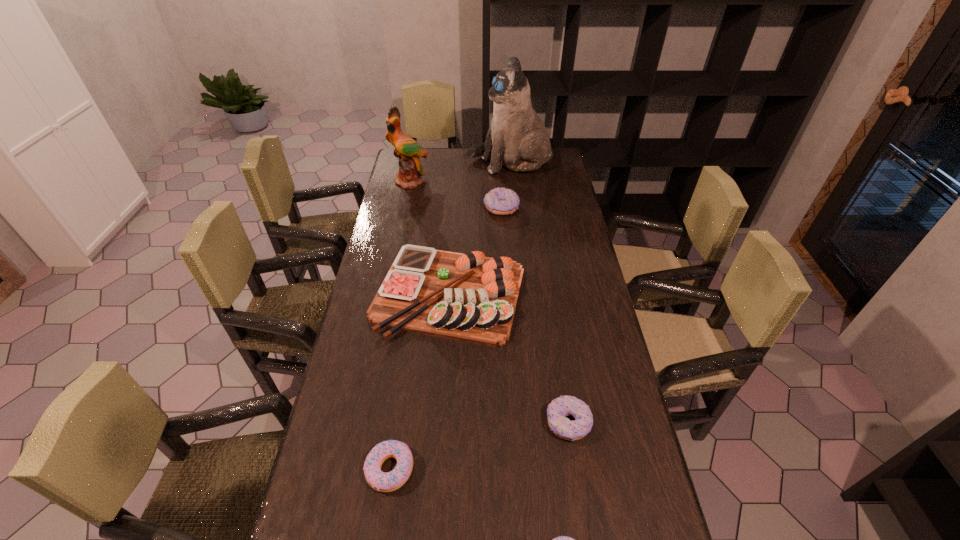
Image resolution: width=960 pixels, height=540 pixels. In the image, there is a desktop. Identify the location of free space at the right edge. (566, 264).

You are a GUI agent. You are given a task and a screenshot of the screen. Output one action in this format:
    pyautogui.click(x=<x>, y=<y>)
    Task: Click on the vacant space that's between the tallest object and the sixth shortest object
    Image resolution: width=960 pixels, height=540 pixels.
    Given the screenshot: What is the action you would take?
    pyautogui.click(x=460, y=172)

At what (x,y) coordinates should I click in order to perform the action: click on empty location between the platter and the tallest object. Please return your answer as a coordinate pair (x, y). This screenshot has width=960, height=540. Looking at the image, I should click on (479, 228).

Where is `free space between the bigger brown doughnut and the third tallest object`? This screenshot has width=960, height=540. free space between the bigger brown doughnut and the third tallest object is located at coordinates (475, 251).

Find the location of a particular element. This screenshot has width=960, height=540. vacant point located between the right brown doughnut and the leftmost doughnut is located at coordinates click(x=479, y=446).

Find the location of a particular element. This screenshot has height=540, width=960. vacant area that lies between the platter and the sixth shortest object is located at coordinates (430, 238).

Image resolution: width=960 pixels, height=540 pixels. Find the location of `free area in between the third tallest object and the sixth shortest object`. free area in between the third tallest object and the sixth shortest object is located at coordinates (430, 238).

In order to click on the closest object to the farther purple doughnut in this screenshot , I will do `click(468, 297)`.

What are the coordinates of `the fourth closest object to the fifth farthest object` in the screenshot? It's located at tap(500, 201).

Locate an element on the screen. The width and height of the screenshot is (960, 540). the closest doughnut to the farther brown doughnut is located at coordinates (559, 408).